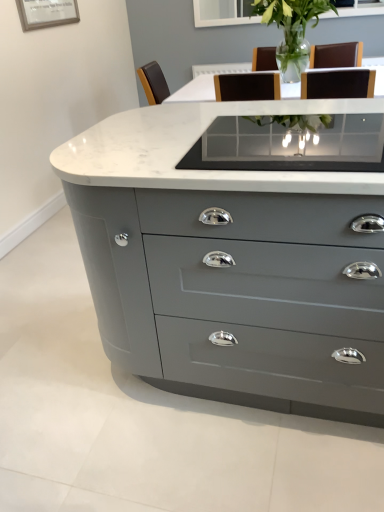
Question: Is matte gray chest of drawers at center thinner than clear glass vase at center?

Choices:
 (A) yes
 (B) no

Answer: (B)

Question: Is the position of matte gray chest of drawers at center less distant than that of clear glass vase at center?

Choices:
 (A) yes
 (B) no

Answer: (A)

Question: From a real-world perspective, is matte gray chest of drawers at center physically below clear glass vase at center?

Choices:
 (A) yes
 (B) no

Answer: (A)

Question: Is clear glass vase at center at the back of matte gray chest of drawers at center?

Choices:
 (A) no
 (B) yes

Answer: (B)

Question: Is clear glass vase at center completely or partially inside matte gray chest of drawers at center?

Choices:
 (A) yes
 (B) no

Answer: (B)

Question: Can you confirm if matte gray chest of drawers at center is smaller than clear glass vase at center?

Choices:
 (A) yes
 (B) no

Answer: (B)

Question: Is clear glass vase at center far away from matte gray chest of drawers at center?

Choices:
 (A) no
 (B) yes

Answer: (B)

Question: Is the position of clear glass vase at center less distant than that of matte gray chest of drawers at center?

Choices:
 (A) yes
 (B) no

Answer: (B)

Question: Considering the relative sizes of clear glass vase at center and matte gray chest of drawers at center in the image provided, is clear glass vase at center wider than matte gray chest of drawers at center?

Choices:
 (A) no
 (B) yes

Answer: (A)

Question: From a real-world perspective, is clear glass vase at center beneath matte gray chest of drawers at center?

Choices:
 (A) yes
 (B) no

Answer: (B)

Question: Does clear glass vase at center have a smaller size compared to matte gray chest of drawers at center?

Choices:
 (A) no
 (B) yes

Answer: (B)

Question: Are clear glass vase at center and matte gray chest of drawers at center making contact?

Choices:
 (A) yes
 (B) no

Answer: (B)

Question: Does clear glass vase at center come behind clear glass table at center?

Choices:
 (A) yes
 (B) no

Answer: (A)